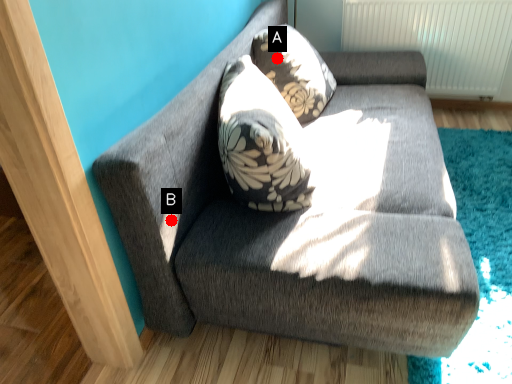
Question: Two points are circled on the image, labeled by A and B beside each circle. Which point appears farthest from the camera in this image?

Choices:
 (A) A is further
 (B) B is further

Answer: (A)